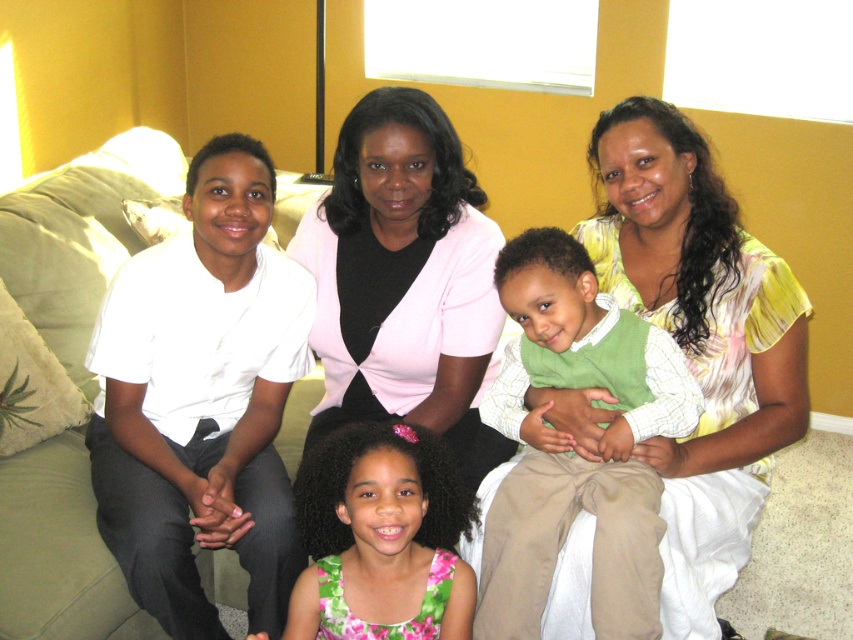
You are a photographer trying to capture a group photo of the family. You notice the green cotton vest at center and the green floral dress at center. Which clothing item should you adjust to ensure both are visible in the frame?

The green cotton vest at center is taller than the green floral dress at center. To ensure both are visible, you should lower the green cotton vest at center or raise the green floral dress at center so they align in height.

You are a photographer setting up a shoot in this living room. You need to position a light source so that it illuminates both the matte white shirt at left and the green cotton vest at center. Based on their positions, which direction should you place the light source to ensure both are well lit?

The matte white shirt at left is located above the green cotton vest at center, so placing the light source below both subjects would cast light upward, effectively illuminating both the matte white shirt at left and the green cotton vest at center.

You are a photographer setting up a camera to capture this family photo. You need to ensure that all subjects are in focus. Since the matte white shirt at left is taller than the green floral dress at center, which subject should you adjust the camera focus on to accommodate their height difference?

You should focus on the matte white shirt at left because it is taller than the green floral dress at center, ensuring the camera captures both subjects clearly by prioritizing the taller individual.